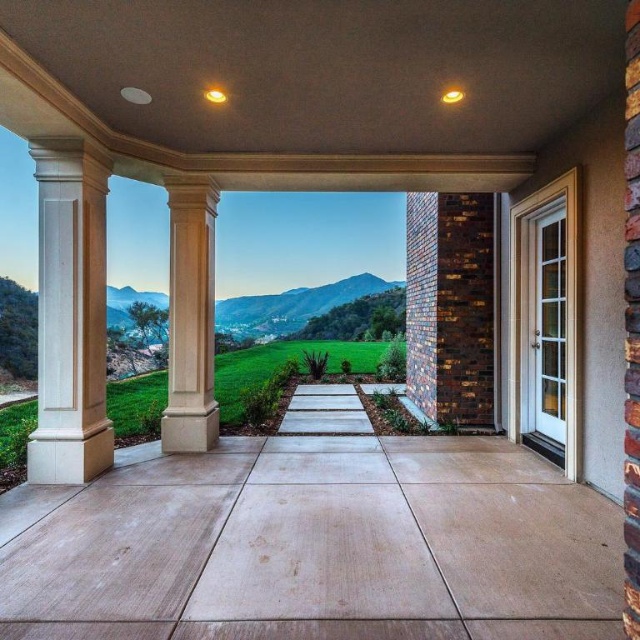
Between white smooth column at left and beige stone column at center, which one has more height?

Standing taller between the two is white smooth column at left.

Measure the distance between point (52, 237) and camera.

Point (52, 237) is 3.89 meters from camera.

Does point (100, 176) lie behind point (196, 433)?

No, it is in front of (196, 433).

The image size is (640, 640). What are the coordinates of `white smooth column at left` in the screenshot? It's located at (70, 316).

Between beige stone column at center and green grass at center, which one has less height?

With less height is beige stone column at center.

Which is in front, point (193, 193) or point (339, 296)?

Positioned in front is point (193, 193).

Who is more forward, (212, 195) or (234, 328)?

Point (212, 195)

Find the location of `beige stone column at center`. beige stone column at center is located at coordinates (189, 317).

Describe the element at coordinates (314, 545) in the screenshot. This screenshot has width=640, height=640. I see `sanded concrete porch at center` at that location.

Does point (324, 525) come behind point (182, 292)?

No, it is not.

Measure the distance between point (449, 625) and camera.

Point (449, 625) is 2.23 meters away from camera.

At what (x,y) coordinates should I click in order to perform the action: click on sanded concrete porch at center. Please return your answer as a coordinate pair (x, y). This screenshot has width=640, height=640. Looking at the image, I should click on [314, 545].